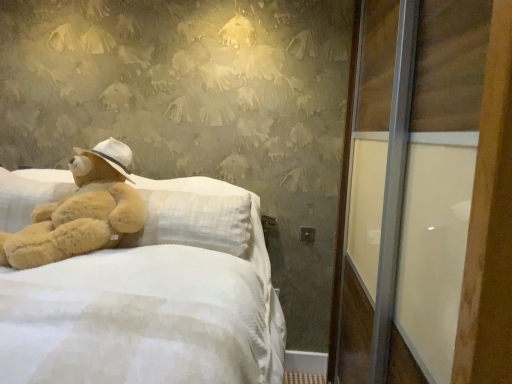
Question: Can you confirm if soft beige plush at left is bigger than transparent glass screen door at right?

Choices:
 (A) yes
 (B) no

Answer: (B)

Question: Is transparent glass screen door at right located within soft beige plush at left?

Choices:
 (A) yes
 (B) no

Answer: (B)

Question: From the image's perspective, is soft beige plush at left above transparent glass screen door at right?

Choices:
 (A) yes
 (B) no

Answer: (A)

Question: Does soft beige plush at left have a smaller size compared to transparent glass screen door at right?

Choices:
 (A) yes
 (B) no

Answer: (A)

Question: Is soft beige plush at left behind transparent glass screen door at right?

Choices:
 (A) yes
 (B) no

Answer: (A)

Question: From a real-world perspective, is soft beige plush at left on top of transparent glass screen door at right?

Choices:
 (A) yes
 (B) no

Answer: (A)

Question: Is transparent glass screen door at right touching soft beige plush at left?

Choices:
 (A) no
 (B) yes

Answer: (A)

Question: Is transparent glass screen door at right positioned with its back to soft beige plush at left?

Choices:
 (A) no
 (B) yes

Answer: (A)

Question: Can you confirm if transparent glass screen door at right is taller than soft beige plush at left?

Choices:
 (A) no
 (B) yes

Answer: (B)

Question: Would you say soft beige plush at left is part of transparent glass screen door at right's contents?

Choices:
 (A) no
 (B) yes

Answer: (A)

Question: From a real-world perspective, is transparent glass screen door at right positioned over soft beige plush at left based on gravity?

Choices:
 (A) yes
 (B) no

Answer: (B)

Question: From the image's perspective, is transparent glass screen door at right under soft beige plush at left?

Choices:
 (A) no
 (B) yes

Answer: (B)

Question: Considering the relative positions of soft plush bed at left and transparent glass screen door at right in the image provided, is soft plush bed at left in front of transparent glass screen door at right?

Choices:
 (A) no
 (B) yes

Answer: (B)